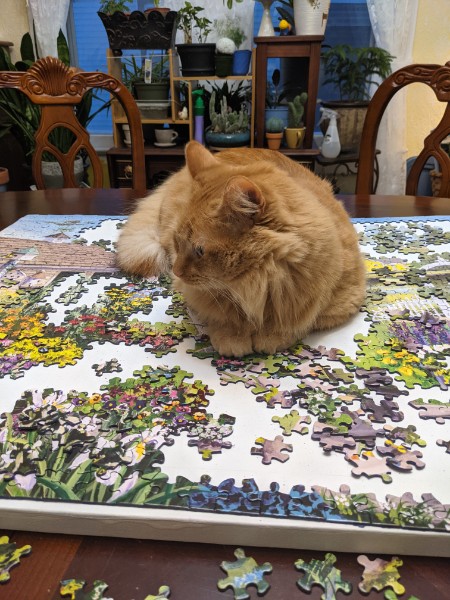
Locate an element on the screen. This screenshot has height=600, width=450. puzzle pieces on table is located at coordinates (379, 571), (331, 571), (244, 567), (162, 589), (99, 593), (74, 585), (5, 554), (392, 595).